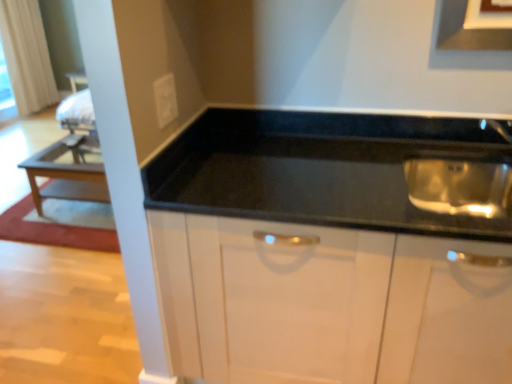
The width and height of the screenshot is (512, 384). I want to click on free spot below wooden table at left (from a real-world perspective), so click(x=80, y=202).